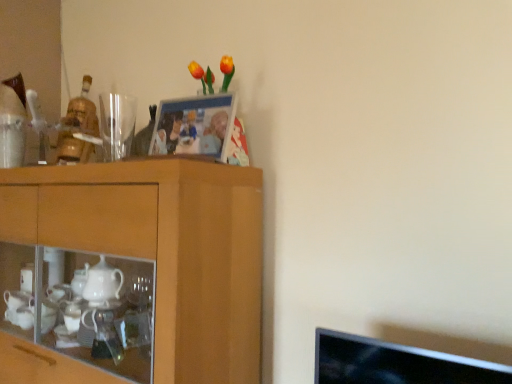
Question: Based on their sizes in the image, would you say wooden photo frame at upper center is bigger or smaller than wooden cabinet at left?

Choices:
 (A) big
 (B) small

Answer: (B)

Question: Considering the positions of wooden photo frame at upper center and wooden cabinet at left in the image, is wooden photo frame at upper center taller or shorter than wooden cabinet at left?

Choices:
 (A) short
 (B) tall

Answer: (A)

Question: Estimate the real-world distances between objects in this image. Which object is farther from the transparent glass at upper left?

Choices:
 (A) wooden cabinet at left
 (B) wooden photo frame at upper center

Answer: (A)

Question: Which of these objects is positioned farthest from the wooden photo frame at upper center?

Choices:
 (A) transparent glass at upper left
 (B) wooden cabinet at left

Answer: (B)